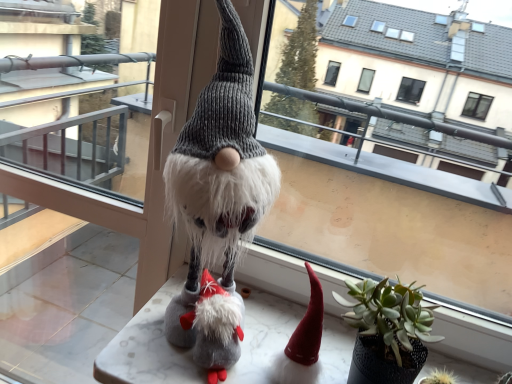
Question: From the image's perspective, is fuzzy gray knit gnome at center above or below transparent glass door at center?

Choices:
 (A) below
 (B) above

Answer: (B)

Question: From a real-world perspective, is fuzzy gray knit gnome at center physically located above or below transparent glass door at center?

Choices:
 (A) above
 (B) below

Answer: (A)

Question: Estimate the real-world distances between objects in this image. Which object is closer to the green matte houseplant at center?

Choices:
 (A) marble table at center
 (B) fuzzy gray knit gnome at center
 (C) transparent glass door at center

Answer: (A)

Question: Considering the real-world distances, which object is farthest from the marble table at center?

Choices:
 (A) transparent glass door at center
 (B) green matte houseplant at center
 (C) fuzzy gray knit gnome at center

Answer: (A)